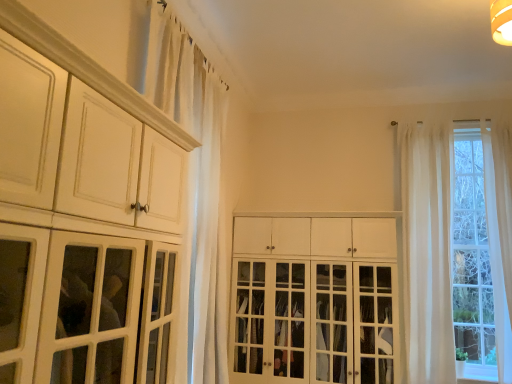
Question: Considering the positions of matte white cabinet at left, the first cabinetry from the front, and white sheer curtain at upper left in the image, is matte white cabinet at left, the first cabinetry from the front, taller or shorter than white sheer curtain at upper left?

Choices:
 (A) short
 (B) tall

Answer: (A)

Question: Considering the positions of matte white cabinet at left, the first cabinetry from the front, and white sheer curtain at upper left in the image, is matte white cabinet at left, the first cabinetry from the front, bigger or smaller than white sheer curtain at upper left?

Choices:
 (A) small
 (B) big

Answer: (B)

Question: Estimate the real-world distances between objects in this image. Which object is farther from the white wood cabinet at center, the first cabinetry viewed from the back?

Choices:
 (A) matte white cabinet at left, which appears as the 2th cabinetry when viewed from the right
 (B) white sheer curtain at upper left
 (C) sheer white curtains at right

Answer: (A)

Question: Which object is the farthest from the white wood cabinet at center, the first cabinetry viewed from the back?

Choices:
 (A) matte white cabinet at left, arranged as the 2th cabinetry when viewed from the back
 (B) white sheer curtain at upper left
 (C) sheer white curtains at right

Answer: (A)